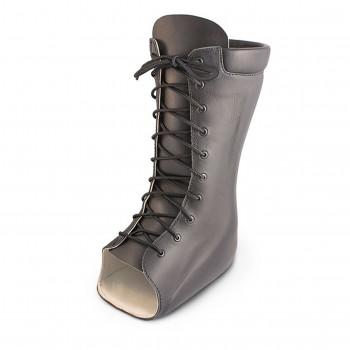
Identify the location of grommets. Image resolution: width=350 pixels, height=350 pixels. (160, 251), (180, 238), (191, 220), (200, 200), (204, 173), (202, 152), (204, 132), (201, 111), (199, 84), (198, 61).